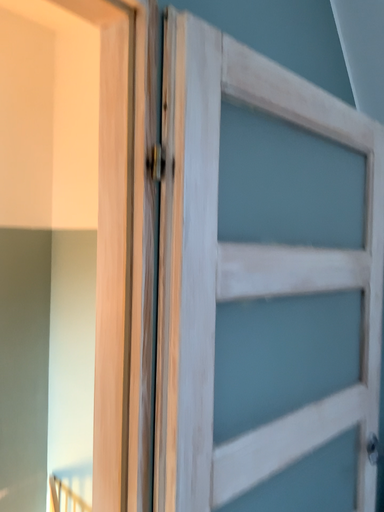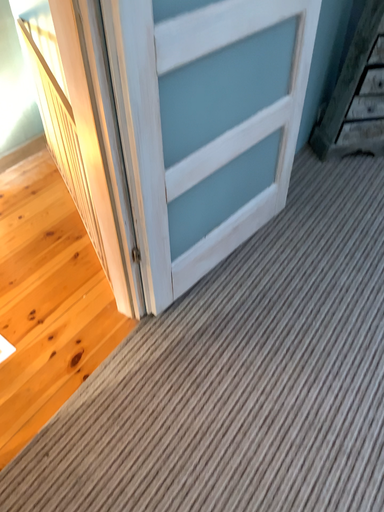
Question: Which way did the camera rotate in the video?

Choices:
 (A) rotated upward
 (B) rotated downward

Answer: (B)